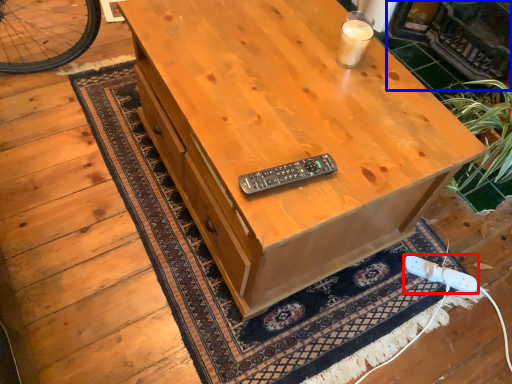
Question: Among these objects, which one is farthest to the camera, game controller (highlighted by a red box) or fireplace (highlighted by a blue box)?

Choices:
 (A) game controller
 (B) fireplace

Answer: (B)